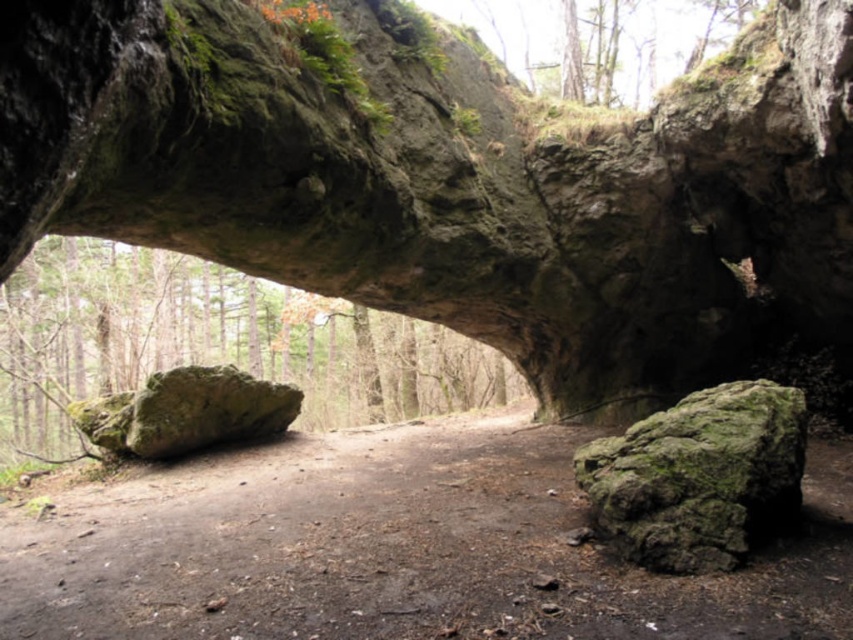
Question: Does dull brown dirt at center have a smaller size compared to green mossy rock at lower right?

Choices:
 (A) yes
 (B) no

Answer: (A)

Question: From the image, what is the correct spatial relationship of green mossy rock at lower right in relation to green mossy rock at left?

Choices:
 (A) below
 (B) above

Answer: (B)

Question: Which point is closer to the camera taking this photo?

Choices:
 (A) 142,410
 (B) 16,560
 (C) 683,438

Answer: (C)

Question: Which of these objects is positioned closest to the green mossy rock at lower right?

Choices:
 (A) dull brown dirt at center
 (B) green mossy rock at left

Answer: (A)

Question: Is green mossy rock at lower right smaller than green mossy rock at left?

Choices:
 (A) yes
 (B) no

Answer: (A)

Question: Which point is closer to the camera taking this photo?

Choices:
 (A) (691, 529)
 (B) (155, 381)

Answer: (A)